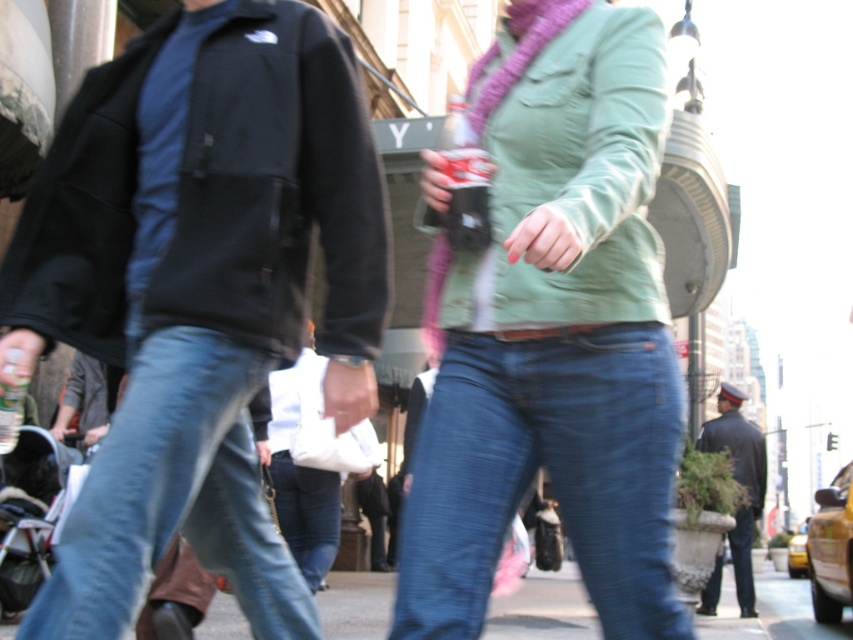
I want to click on denim at center, so tap(306, 513).

What do you see at coordinates (306, 513) in the screenshot?
I see `denim at center` at bounding box center [306, 513].

You are a GUI agent. You are given a task and a screenshot of the screen. Output one action in this format:
    pyautogui.click(x=<x>, y=<y>)
    Task: Click on the denim at center
    Image resolution: width=853 pixels, height=640 pixels.
    Given the screenshot: What is the action you would take?
    pyautogui.click(x=306, y=513)

Measure the distance from matte green jacket at center to denim at center.

matte green jacket at center and denim at center are 4.78 meters apart.

Between point (480, 138) and point (299, 531), which one is positioned in front?

Point (480, 138) is more forward.

The width and height of the screenshot is (853, 640). What do you see at coordinates (555, 337) in the screenshot?
I see `matte green jacket at center` at bounding box center [555, 337].

At what (x,y) coordinates should I click in order to perform the action: click on matte green jacket at center. Please return your answer as a coordinate pair (x, y). Looking at the image, I should click on (555, 337).

Does point (117, 81) come behind point (759, 499)?

No, (117, 81) is closer to viewer.

Is black fleece jacket at left thinner than dark blue uniform at right?

Correct, black fleece jacket at left's width is less than dark blue uniform at right's.

Which is in front, point (73, 120) or point (747, 428)?

Point (73, 120)

This screenshot has width=853, height=640. I want to click on black fleece jacket at left, so click(x=276, y=188).